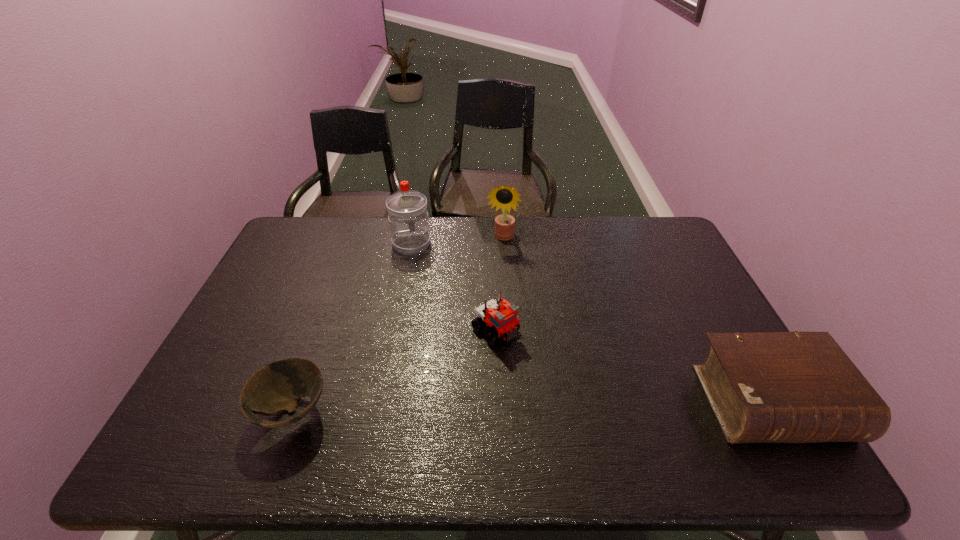
Where is `vacant space on the desktop that is between the bowl and the Bible and is positioned on the front-facing side of the Lego`? This screenshot has height=540, width=960. vacant space on the desktop that is between the bowl and the Bible and is positioned on the front-facing side of the Lego is located at coordinates (582, 406).

This screenshot has width=960, height=540. I want to click on vacant space on the desktop that is between the bowl and the rightmost object and is positioned on the face of the sunflower, so click(464, 408).

At what (x,y) coordinates should I click in order to perform the action: click on free spot on the desktop that is between the bowl and the rightmost object and is positioned on the handle side of the fourth object from right to left. Please return your answer as a coordinate pair (x, y). This screenshot has width=960, height=540. Looking at the image, I should click on (468, 408).